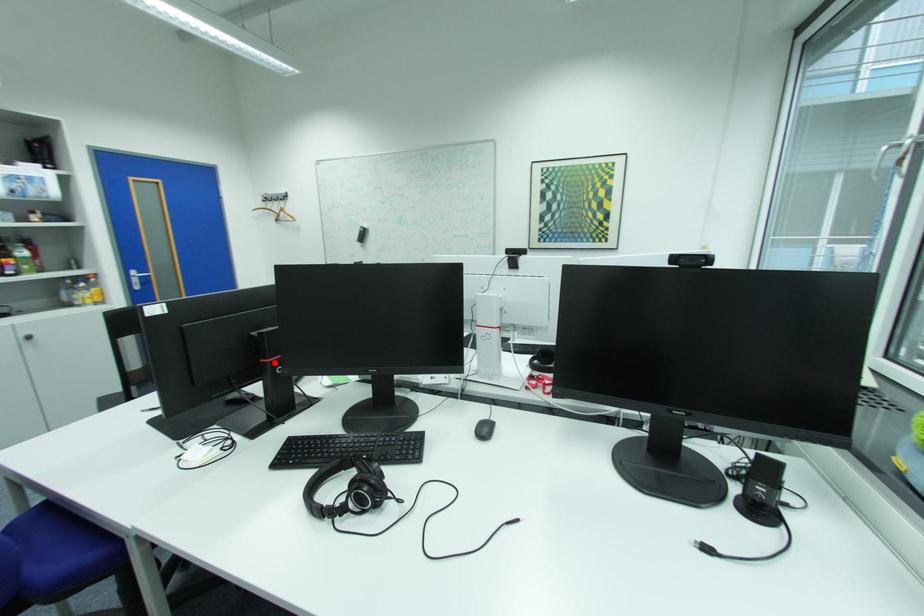
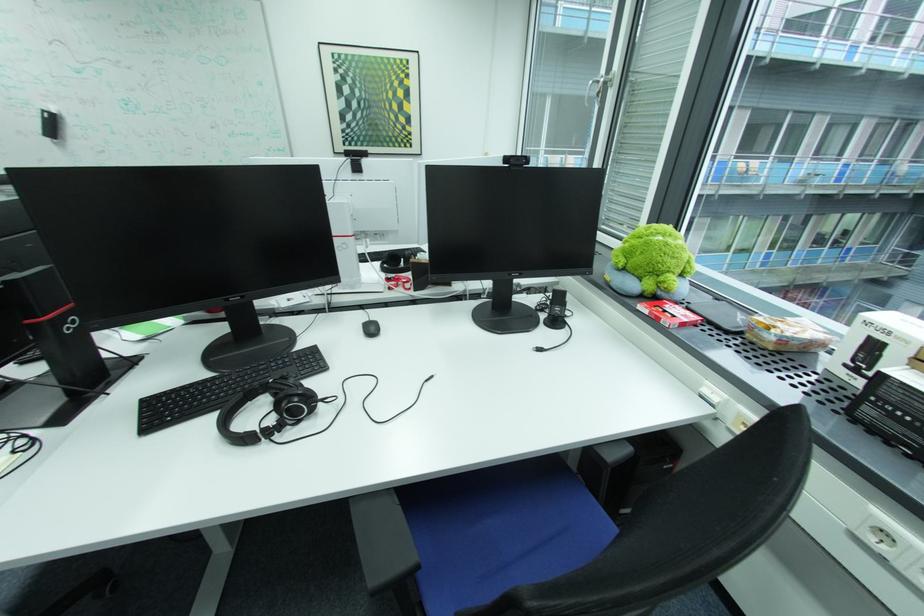
Question: A red point is marked in image1. In image2, is the corresponding 3D point closer to the camera or farther? Reply with the corresponding letter.

Choices:
 (A) The corresponding 3D point is closer.
 (B) The corresponding 3D point is farther.

Answer: (B)